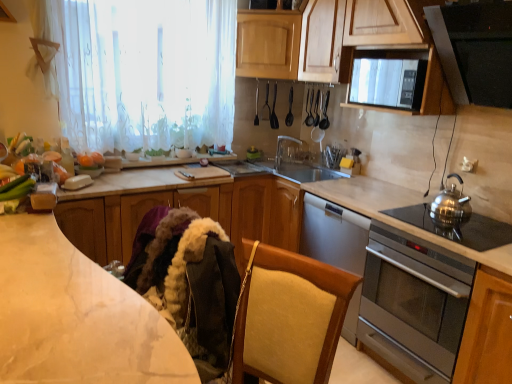
What are the coordinates of `blank space to the left of clear plastic tap at center` in the screenshot? It's located at (264, 170).